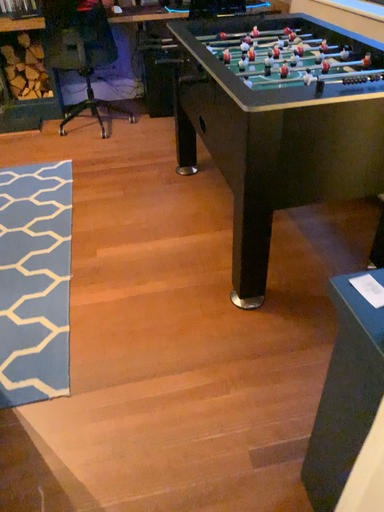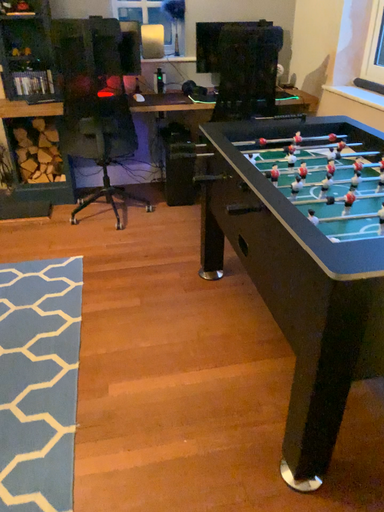
Question: How did the camera likely rotate when shooting the video?

Choices:
 (A) rotated upward
 (B) rotated downward

Answer: (A)